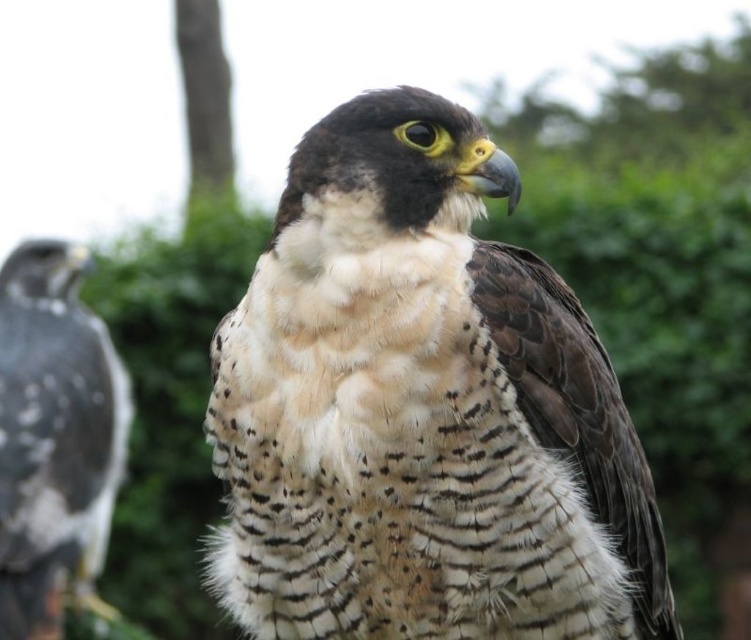
Does speckled brown falcon at left appear on the right side of green textured tree at upper left?

No, speckled brown falcon at left is not to the right of green textured tree at upper left.

Is speckled brown falcon at left below green textured tree at upper left?

Indeed, speckled brown falcon at left is positioned under green textured tree at upper left.

Image resolution: width=751 pixels, height=640 pixels. Find the location of `speckled brown falcon at left`. speckled brown falcon at left is located at coordinates (53, 436).

Is speckled feathered falcon at center bigger than green textured tree at upper left?

Yes.

Does speckled feathered falcon at center come behind green textured tree at upper left?

No, it is not.

You are a GUI agent. You are given a task and a screenshot of the screen. Output one action in this format:
    pyautogui.click(x=<x>, y=<y>)
    Task: Click on the speckled feathered falcon at center
    The image size is (751, 640).
    Given the screenshot: What is the action you would take?
    pyautogui.click(x=421, y=410)

Find the location of a particular element. speckled feathered falcon at center is located at coordinates (421, 410).

Can you confirm if speckled feathered falcon at center is smaller than speckled brown falcon at left?

Yes.

Measure the distance from speckled feathered falcon at center to speckled brown falcon at left.

speckled feathered falcon at center and speckled brown falcon at left are 1.63 meters apart.

What are the coordinates of `speckled feathered falcon at center` in the screenshot? It's located at (421, 410).